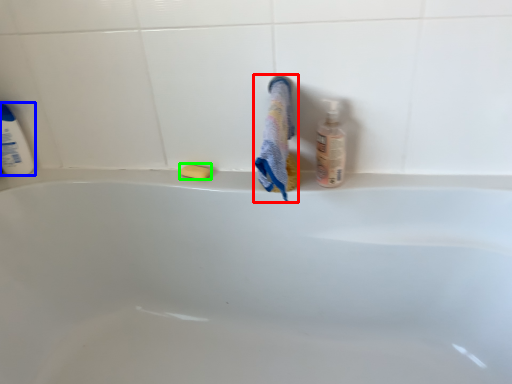
Question: Estimate the real-world distances between objects in this image. Which object is closer to bath towel (highlighted by a red box), cleaning product (highlighted by a blue box) or soap (highlighted by a green box)?

Choices:
 (A) cleaning product
 (B) soap

Answer: (B)